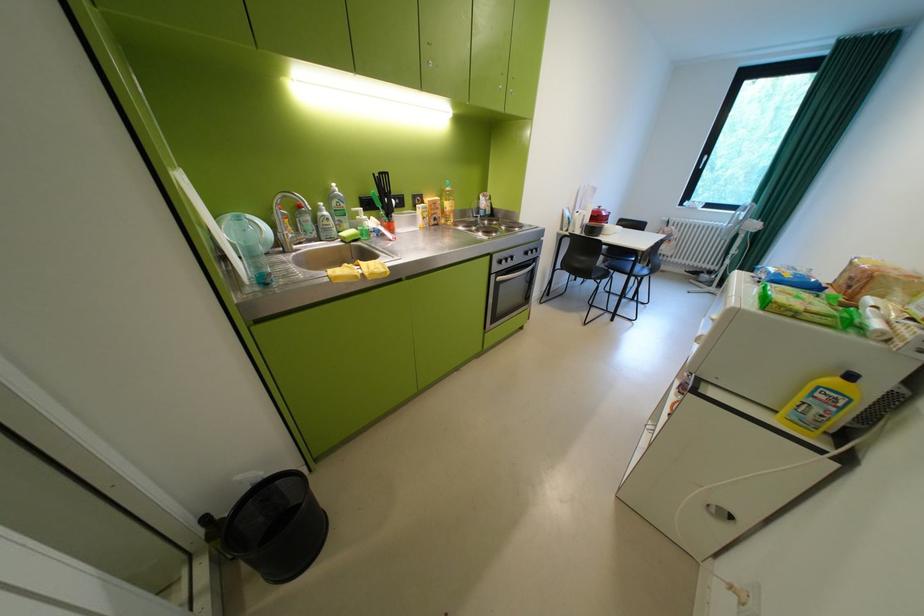
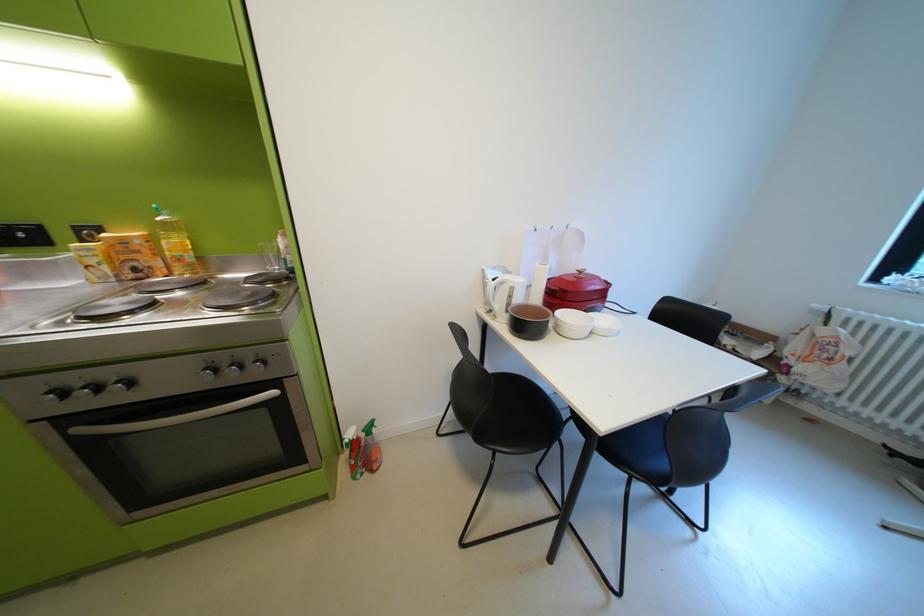
Which direction would the cameraman need to move to produce the second image?

The cameraman moved toward right, forward.